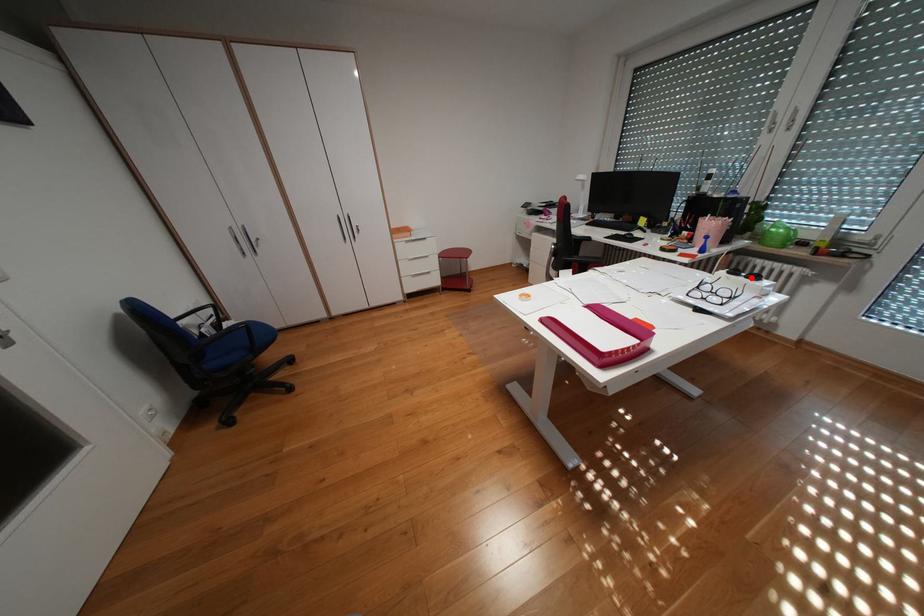
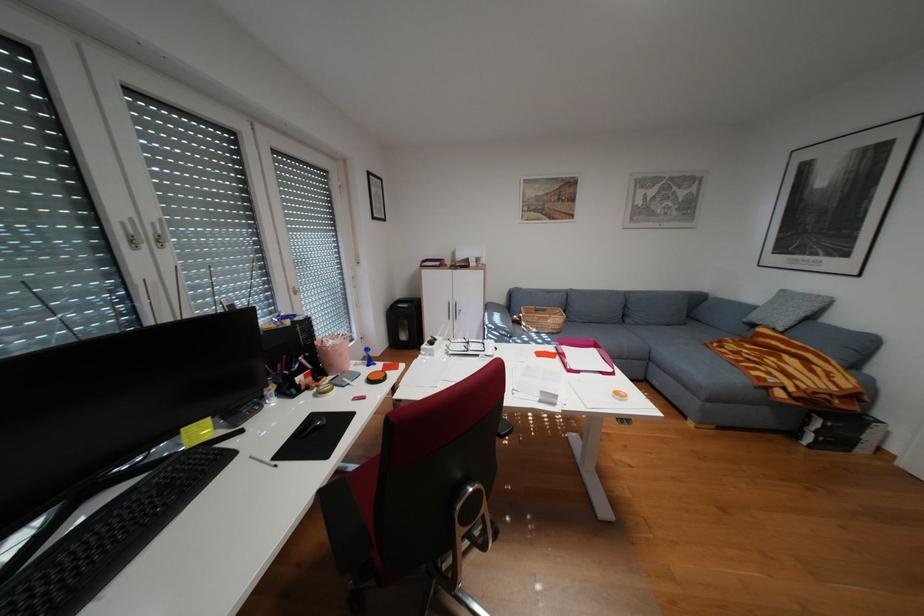
In the second image, find the point that corresponds to the highlighted location in the first image.

(448, 342)